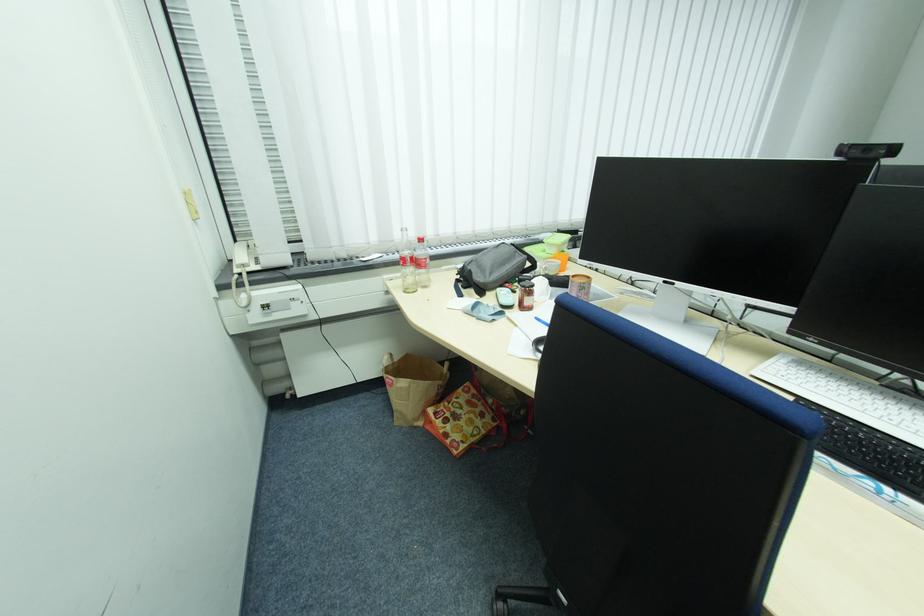
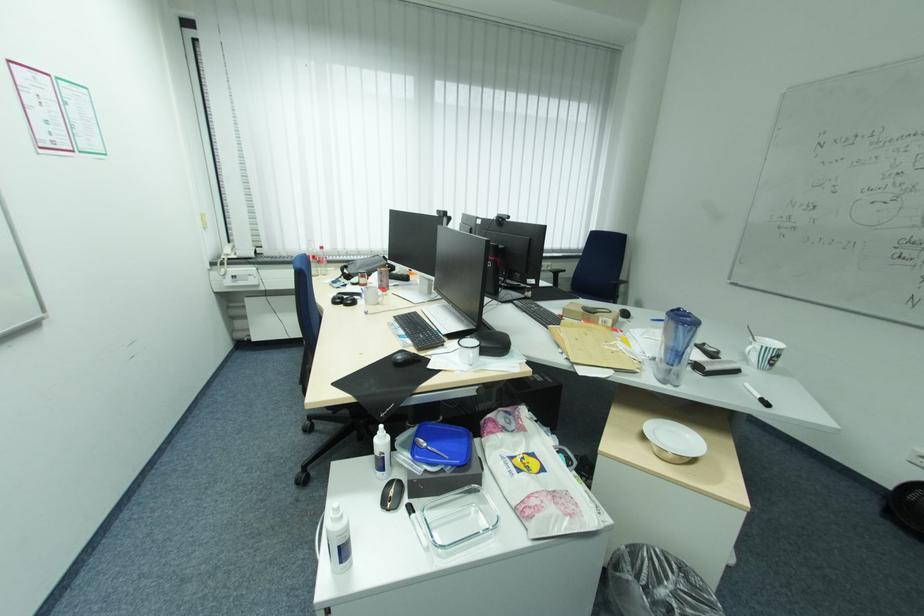
Where in the second image is the point corresponding to (893,488) from the first image?

(407, 329)